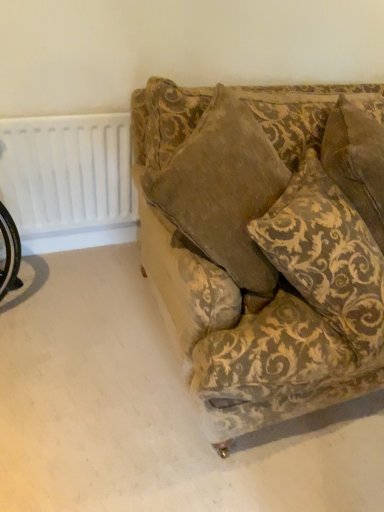
Question: Is gold-patterned fabric pillow at upper right positioned before white plastic radiator at upper left?

Choices:
 (A) no
 (B) yes

Answer: (B)

Question: Does gold-patterned fabric pillow at upper right have a lesser height compared to white plastic radiator at upper left?

Choices:
 (A) no
 (B) yes

Answer: (A)

Question: Is gold-patterned fabric pillow at upper right oriented away from white plastic radiator at upper left?

Choices:
 (A) yes
 (B) no

Answer: (A)

Question: From the image's perspective, is gold-patterned fabric pillow at upper right over white plastic radiator at upper left?

Choices:
 (A) no
 (B) yes

Answer: (A)

Question: Can you confirm if gold-patterned fabric pillow at upper right is positioned to the right of white plastic radiator at upper left?

Choices:
 (A) no
 (B) yes

Answer: (B)

Question: Can you confirm if gold-patterned fabric pillow at upper right is smaller than white plastic radiator at upper left?

Choices:
 (A) no
 (B) yes

Answer: (A)

Question: Is velvet-patterned couch at center completely or partially inside white plastic radiator at upper left?

Choices:
 (A) no
 (B) yes

Answer: (A)

Question: From the image's perspective, is white plastic radiator at upper left located beneath velvet-patterned couch at center?

Choices:
 (A) no
 (B) yes

Answer: (A)

Question: Considering the relative positions of white plastic radiator at upper left and velvet-patterned couch at center in the image provided, is white plastic radiator at upper left to the right of velvet-patterned couch at center from the viewer's perspective?

Choices:
 (A) no
 (B) yes

Answer: (A)

Question: Is white plastic radiator at upper left aimed at velvet-patterned couch at center?

Choices:
 (A) no
 (B) yes

Answer: (B)

Question: Considering the relative sizes of white plastic radiator at upper left and velvet-patterned couch at center in the image provided, is white plastic radiator at upper left taller than velvet-patterned couch at center?

Choices:
 (A) no
 (B) yes

Answer: (A)

Question: Can we say white plastic radiator at upper left lies outside velvet-patterned couch at center?

Choices:
 (A) no
 (B) yes

Answer: (B)

Question: From a real-world perspective, is gold-patterned fabric pillow at upper right over velvet-patterned couch at center?

Choices:
 (A) no
 (B) yes

Answer: (B)